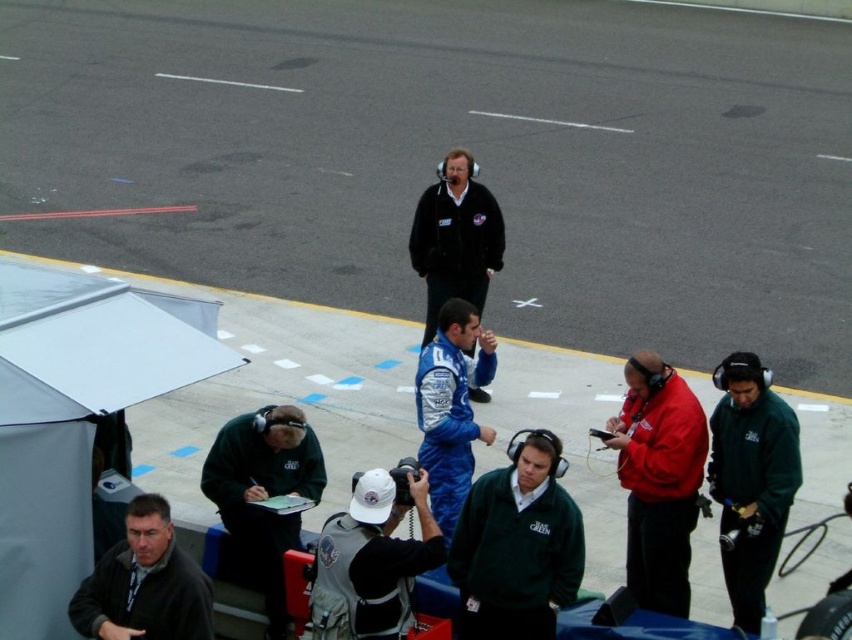
You are a photographer positioned at the edge of the pit lane and need to capture both the green fleece jacket at center and the green fleece jacket at lower left in a single shot. Which direction should you pan your camera to include both individuals in the frame?

To include both the green fleece jacket at center and the green fleece jacket at lower left in the frame, you should pan your camera to the left since the green fleece jacket at center is to the right of the green fleece jacket at lower left.